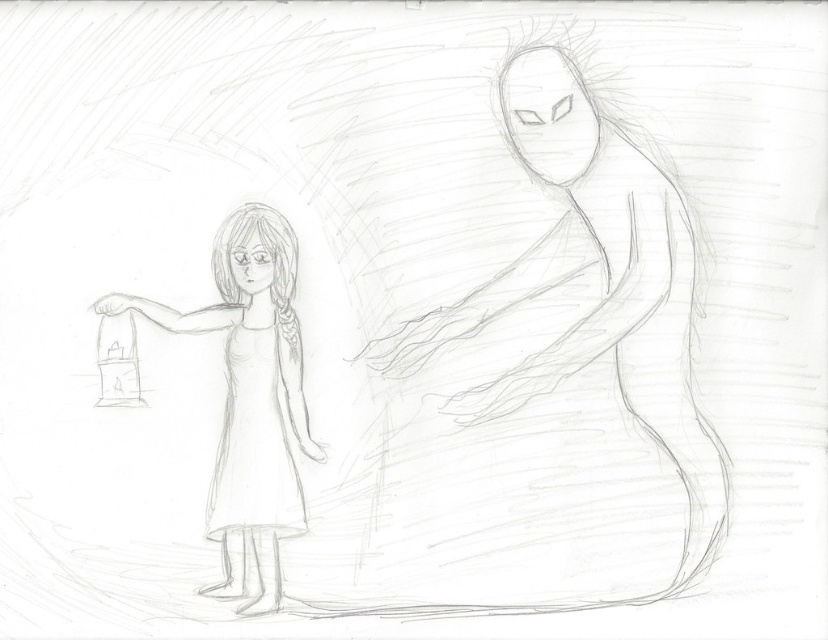
Question: Which of the following is the closest to the observer?

Choices:
 (A) (238, 444)
 (B) (272, 424)

Answer: (A)

Question: Does smooth paper lantern at left have a smaller size compared to white paper dress at center?

Choices:
 (A) yes
 (B) no

Answer: (B)

Question: Is smooth paper lantern at left below white paper dress at center?

Choices:
 (A) yes
 (B) no

Answer: (B)

Question: Which point is closer to the camera taking this photo?

Choices:
 (A) (243, 424)
 (B) (239, 336)

Answer: (A)

Question: Does smooth paper lantern at left have a lesser width compared to white paper dress at center?

Choices:
 (A) no
 (B) yes

Answer: (A)

Question: Which point is farther to the camera?

Choices:
 (A) white paper dress at center
 (B) smooth paper lantern at left

Answer: (B)